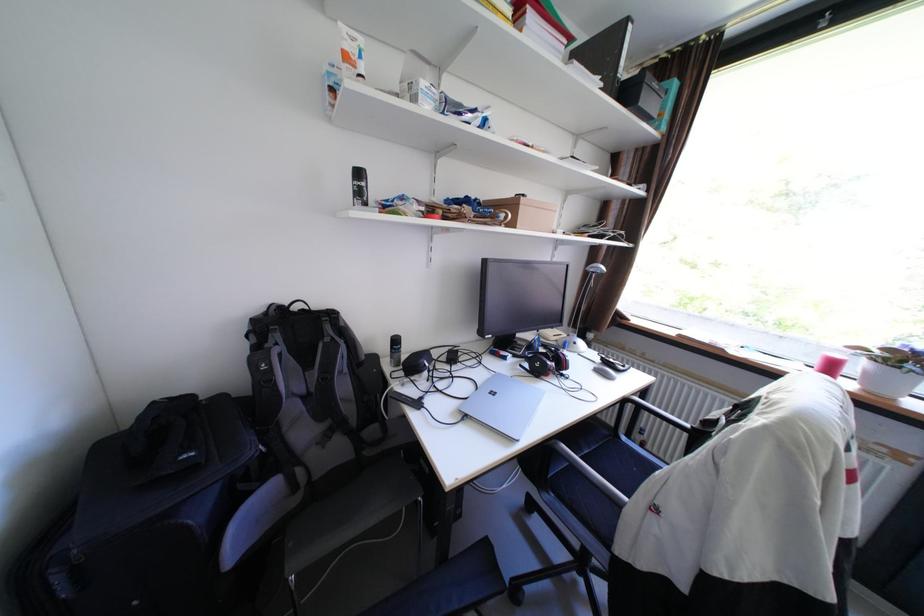
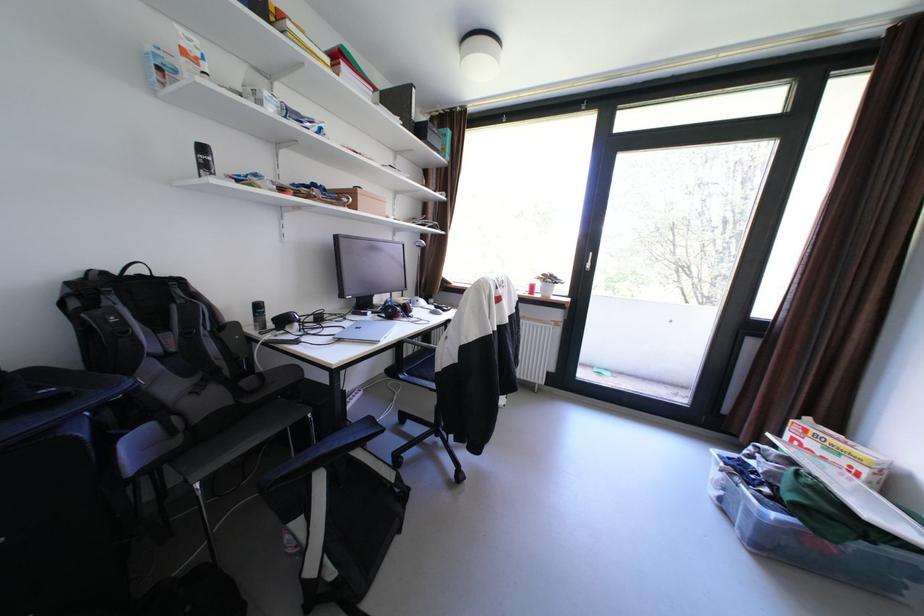
Question: The images are taken continuously from a first-person perspective. In which direction is your viewpoint rotating?

Choices:
 (A) Left
 (B) Right
 (C) Up
 (D) Down

Answer: (B)